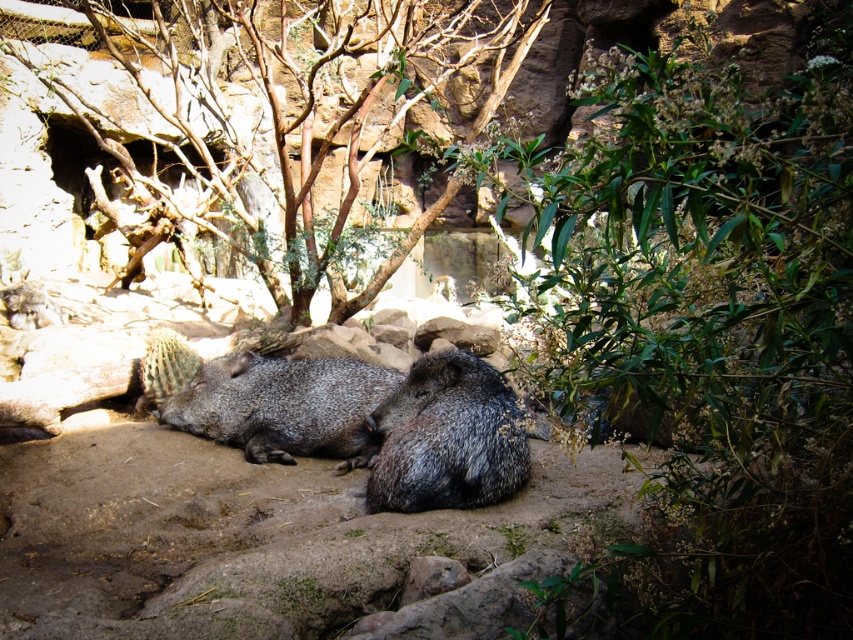
Between point (514, 470) and point (363, 419), which one is positioned in front?

Point (514, 470)

Who is positioned more to the left, gray fuzzy animal at center or gray spiny at center?

Positioned to the left is gray spiny at center.

Is point (404, 432) positioned after point (207, 422)?

No, (404, 432) is closer to viewer.

Identify the location of gray fuzzy animal at center. This screenshot has width=853, height=640. (447, 436).

Locate an element on the screen. green leafy plant at center is located at coordinates [714, 326].

Who is more forward, (735, 234) or (440, 349)?

Point (735, 234)

The image size is (853, 640). In order to click on green leafy plant at center in this screenshot , I will do `click(714, 326)`.

Does green leafy plant at center lie in front of brown rough bark tree at center?

Yes, green leafy plant at center is closer to the viewer.

Is green leafy plant at center to the left of brown rough bark tree at center from the viewer's perspective?

In fact, green leafy plant at center is to the right of brown rough bark tree at center.

Describe the element at coordinates (714, 326) in the screenshot. The height and width of the screenshot is (640, 853). I see `green leafy plant at center` at that location.

I want to click on green leafy plant at center, so click(x=714, y=326).